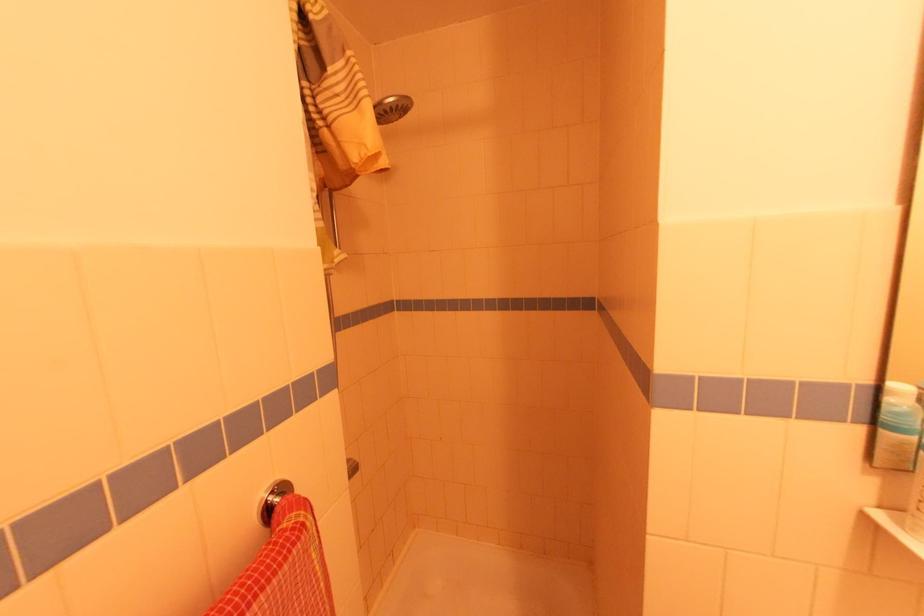
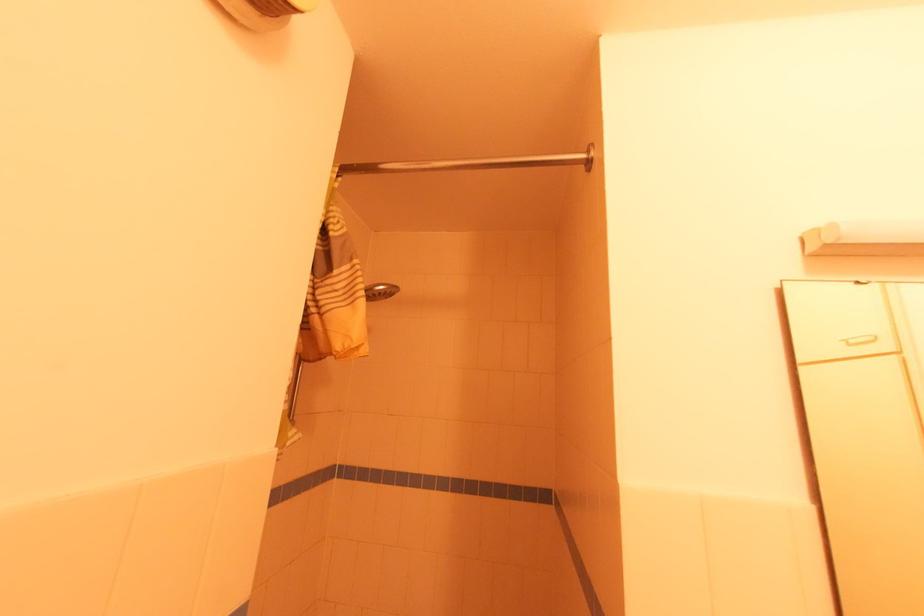
In a continuous first-person perspective shot, in which direction is the camera moving?

The cameraman moved toward left, backward.